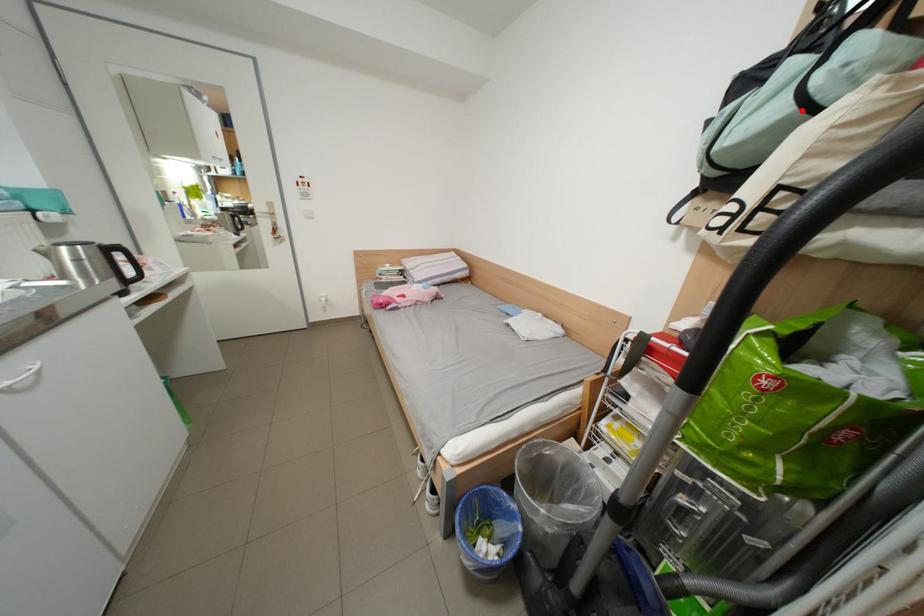
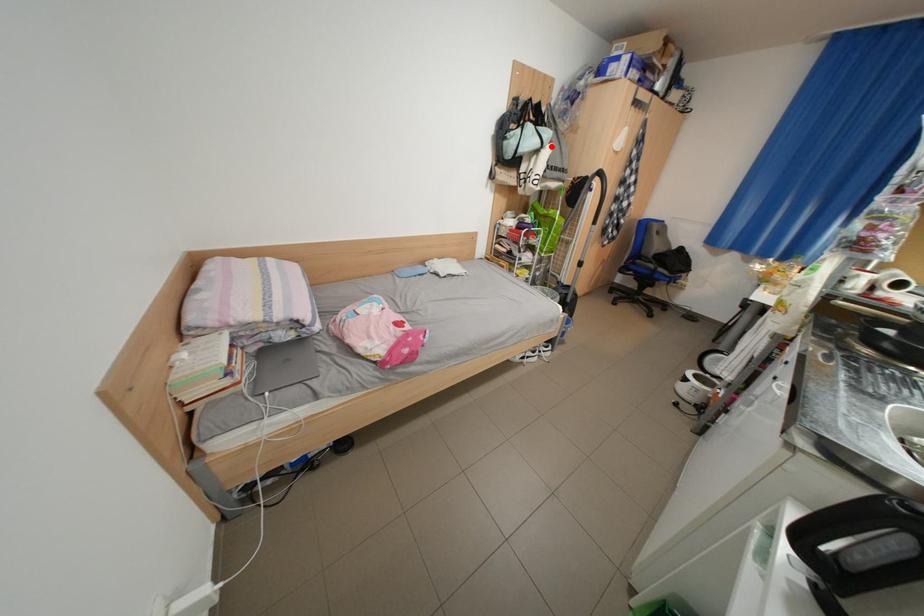
I am providing you with two images of the same scene from different viewpoints. A red point is marked on the first image and another point is marked on the second image. Is the marked point in image1 the same physical position as the marked point in image2?

Yes